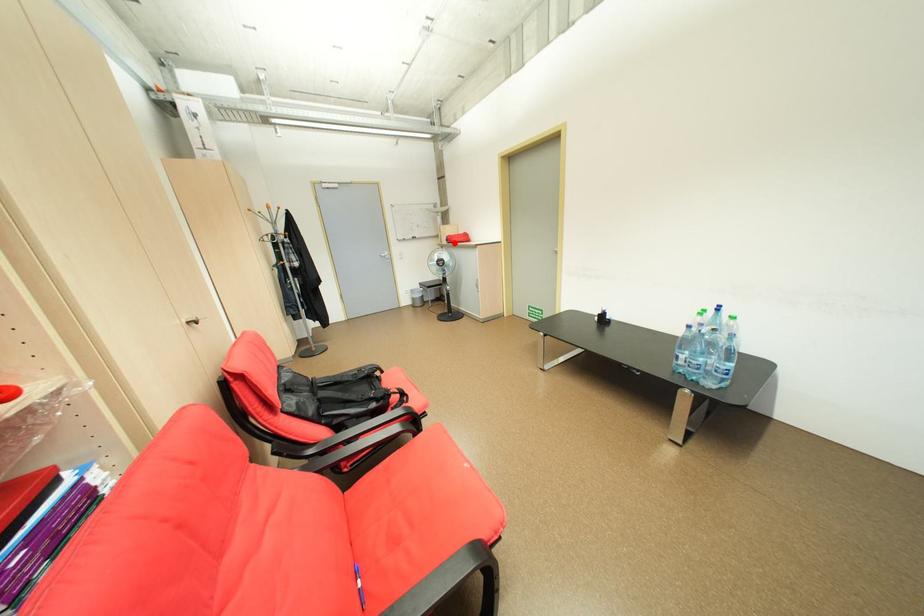
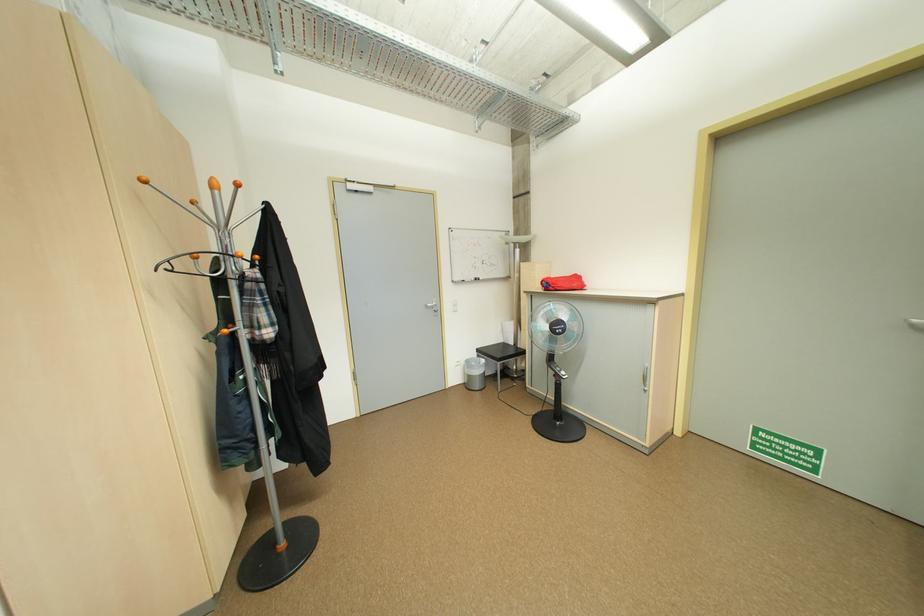
Question: I am providing you with two images of the same scene from different viewpoints. Image1 has a red point marked. In image2, the corresponding 3D location appears at what relative position? Reply with the corresponding letter.

Choices:
 (A) Closer
 (B) Farther

Answer: (B)